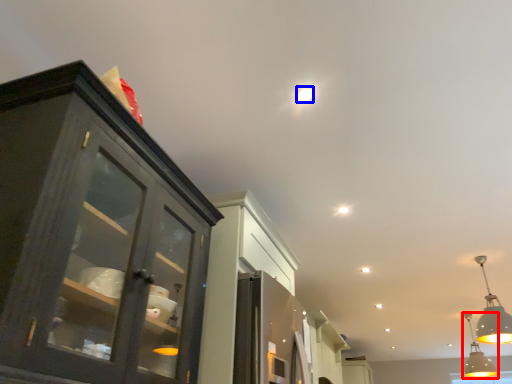
Question: Which object is further to the camera taking this photo, light fixture (highlighted by a red box) or droplight (highlighted by a blue box)?

Choices:
 (A) light fixture
 (B) droplight

Answer: (A)